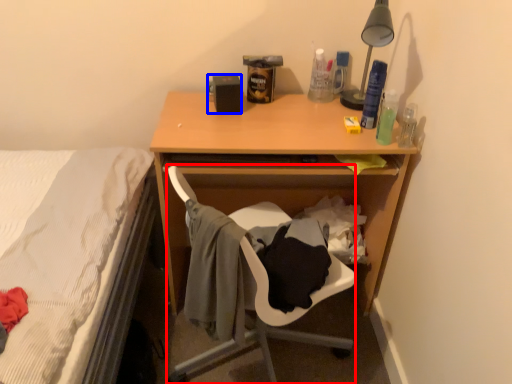
Question: Which of the following is the farthest to the observer, chair (highlighted by a red box) or loudspeaker (highlighted by a blue box)?

Choices:
 (A) chair
 (B) loudspeaker

Answer: (B)